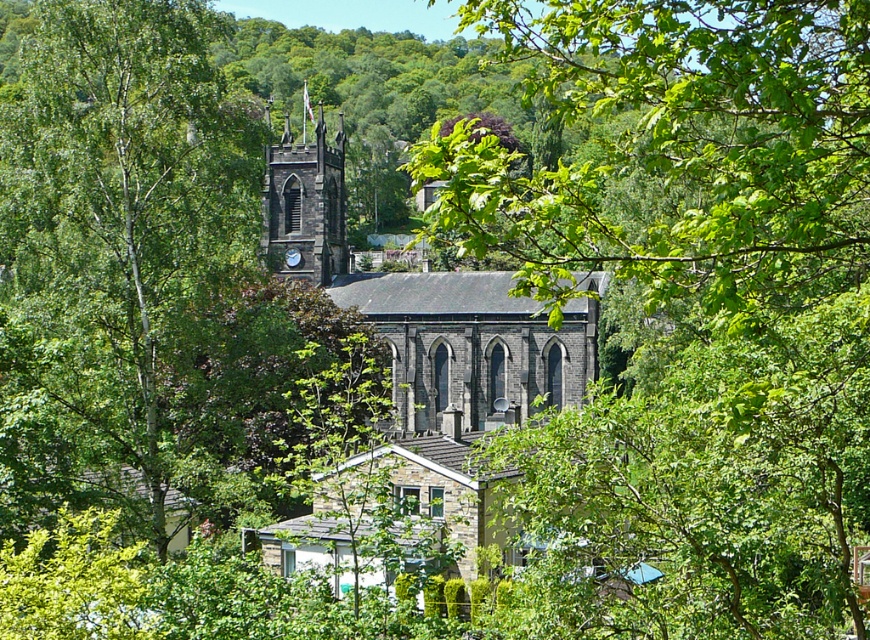
You are standing in a park and see the green leafy tree at center and the dark gray stone clock tower at center. Which one is taller?

The green leafy tree at center is taller than the dark gray stone clock tower at center.

You are a landscape architect designing a walking path between the green leafy tree at center and the dark gray stone clock tower at center. If the path must be exactly 100 feet long, will it be possible to create such a path between them?

The green leafy tree at center is 112.05 feet from the dark gray stone clock tower at center. Since the required path length is 100 feet, which is shorter than the actual distance between them, the path cannot be exactly 100 feet long. The path would need to be extended or the distance between them reduced to meet the requirement.